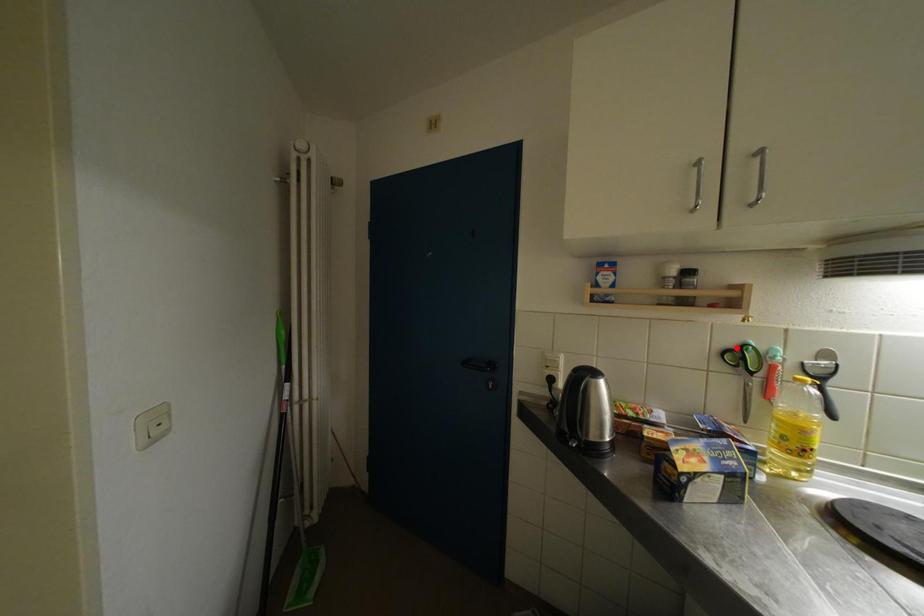
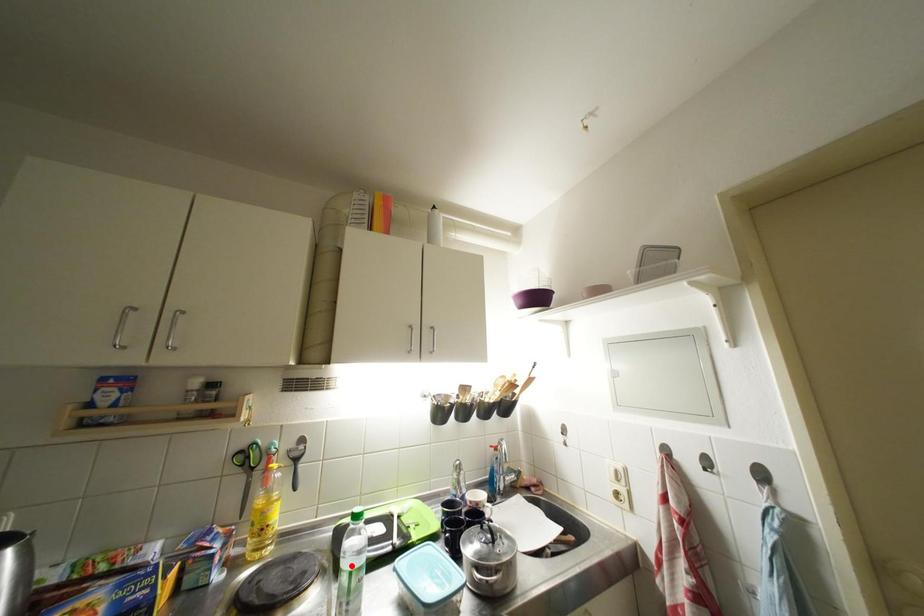
I am providing you with two images of the same scene from different viewpoints. A red point is marked on the first image and another point is marked on the second image. Do the highlighted points in image1 and image2 indicate the same real-world spot?

No